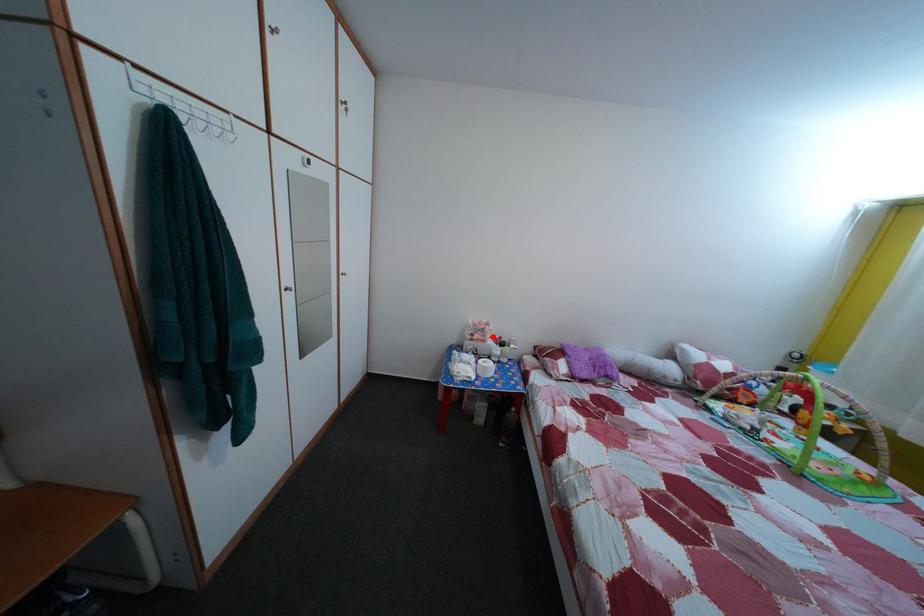
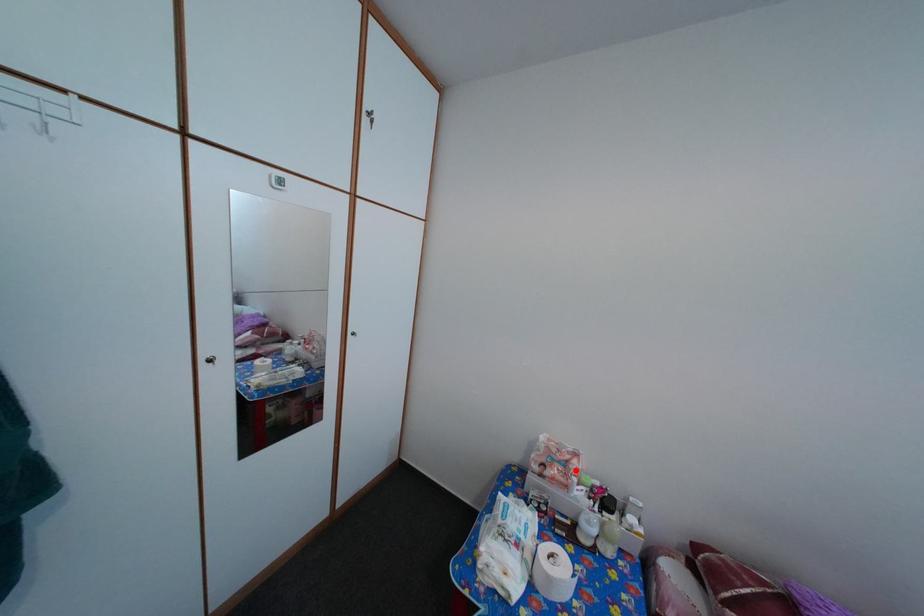
I am providing you with two images of the same scene from different viewpoints. A red point is marked on the first image and another point is marked on the second image. Does the point marked in image1 correspond to the same location as the one in image2?

Yes